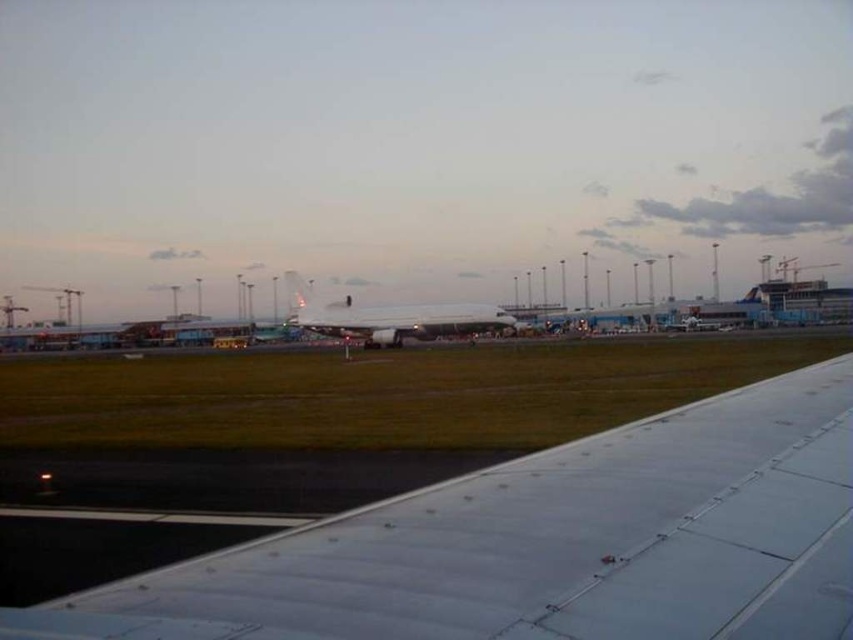
Question: Which of the following is the farthest from the observer?

Choices:
 (A) (229, 612)
 (B) (370, 317)

Answer: (B)

Question: Is white metallic wing at lower right below white glossy airplane at center?

Choices:
 (A) yes
 (B) no

Answer: (A)

Question: Which point is farther to the camera?

Choices:
 (A) (331, 308)
 (B) (705, 595)

Answer: (A)

Question: Is white metallic wing at lower right below white glossy airplane at center?

Choices:
 (A) yes
 (B) no

Answer: (A)

Question: Is white metallic wing at lower right in front of white glossy airplane at center?

Choices:
 (A) no
 (B) yes

Answer: (B)

Question: Which of the following is the closest to the observer?

Choices:
 (A) (369, 336)
 (B) (637, 577)

Answer: (B)